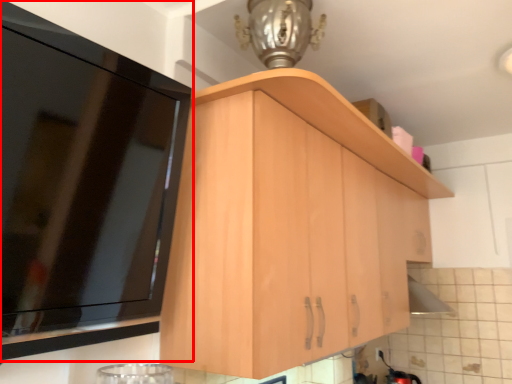
Question: From the image's perspective, considering the relative positions of cabinetry (annotated by the red box) and cabinetry in the image provided, where is cabinetry (annotated by the red box) located with respect to the staircase?

Choices:
 (A) below
 (B) above

Answer: (B)